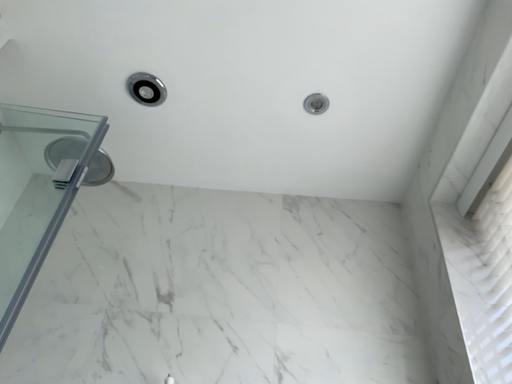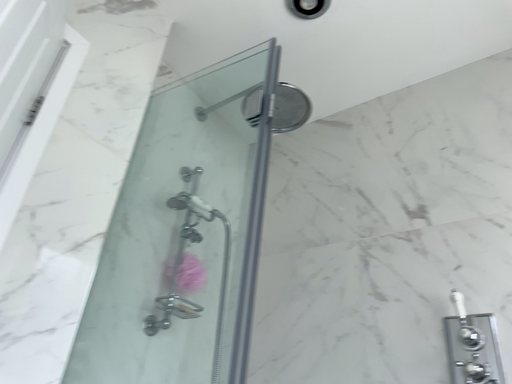
Question: How did the camera likely rotate when shooting the video?

Choices:
 (A) rotated downward
 (B) rotated upward

Answer: (A)